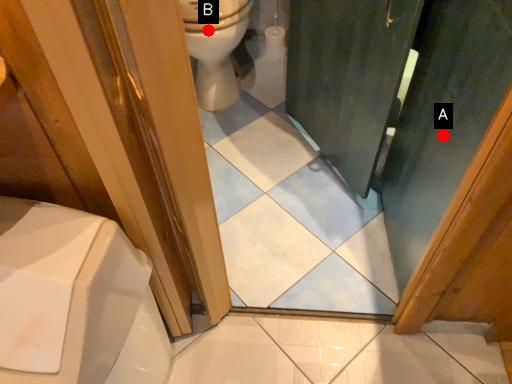
Question: Two points are circled on the image, labeled by A and B beside each circle. Which of the following is the farthest from the observer?

Choices:
 (A) A is further
 (B) B is further

Answer: (B)